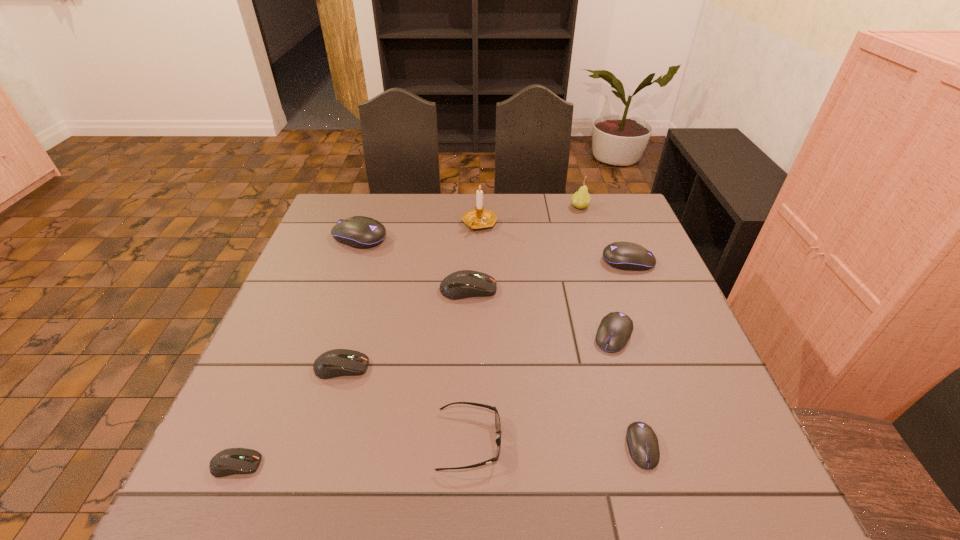
Find the location of a particular element. candle holder is located at coordinates (478, 218).

The height and width of the screenshot is (540, 960). Identify the location of the tallest object. (478, 218).

The image size is (960, 540). What are the coordinates of `the second tallest object` in the screenshot? It's located at (581, 199).

Where is `pear`? pear is located at coordinates (581, 199).

In order to click on the farthest black computer mouse in this screenshot , I will do `click(360, 232)`.

At what (x,y) coordinates should I click in order to perform the action: click on the leftmost black computer mouse. Please return your answer as a coordinate pair (x, y). This screenshot has height=540, width=960. Looking at the image, I should click on (360, 232).

Where is `the fifth nearest computer mouse`? The height and width of the screenshot is (540, 960). the fifth nearest computer mouse is located at coordinates (462, 284).

Locate an element on the screen. the farthest dark computer equipment is located at coordinates (462, 284).

The image size is (960, 540). Identify the location of the seventh nearest object. (628, 256).

Locate an element on the screen. The image size is (960, 540). the third nearest black computer mouse is located at coordinates (x=628, y=256).